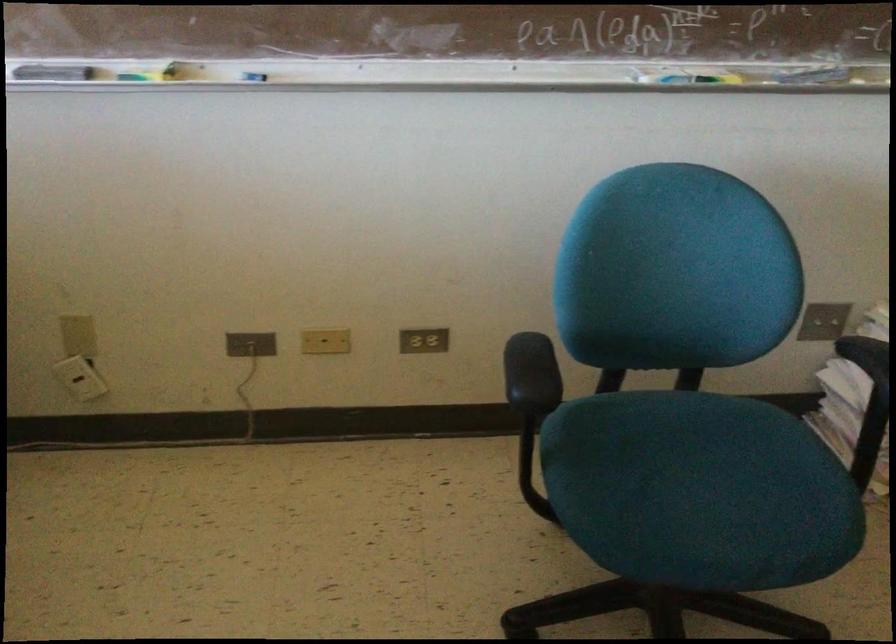
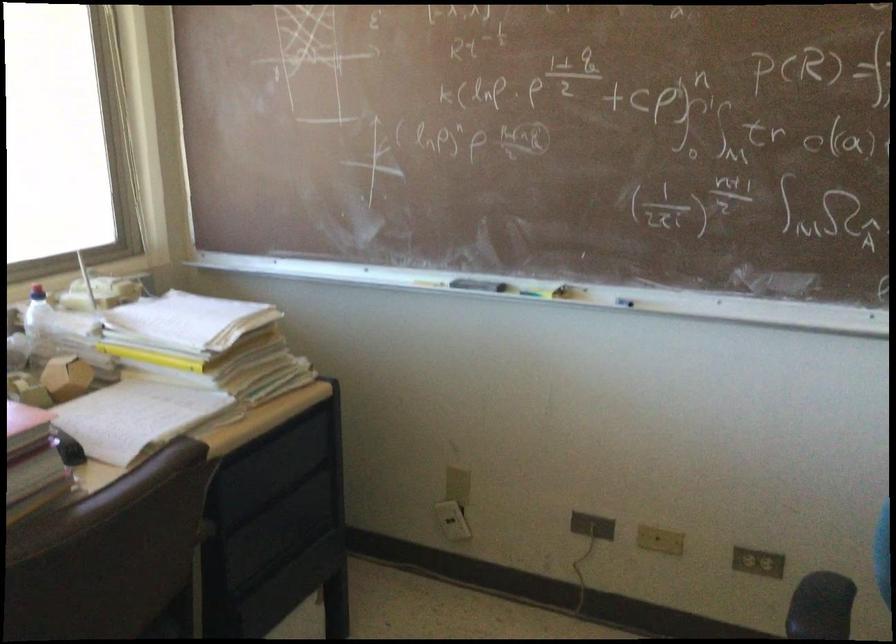
Find the pixel in the second image that matches (79,377) in the first image.

(452, 520)